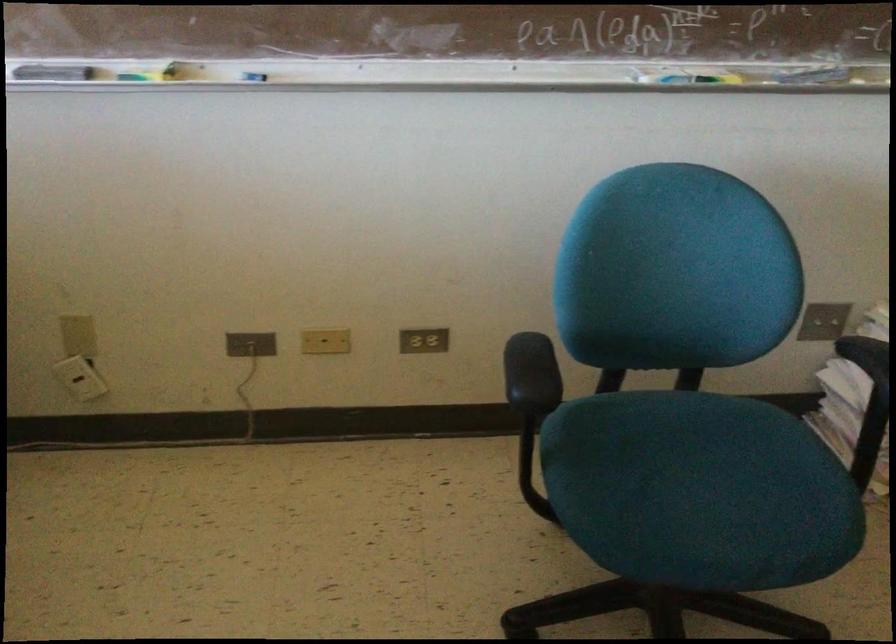
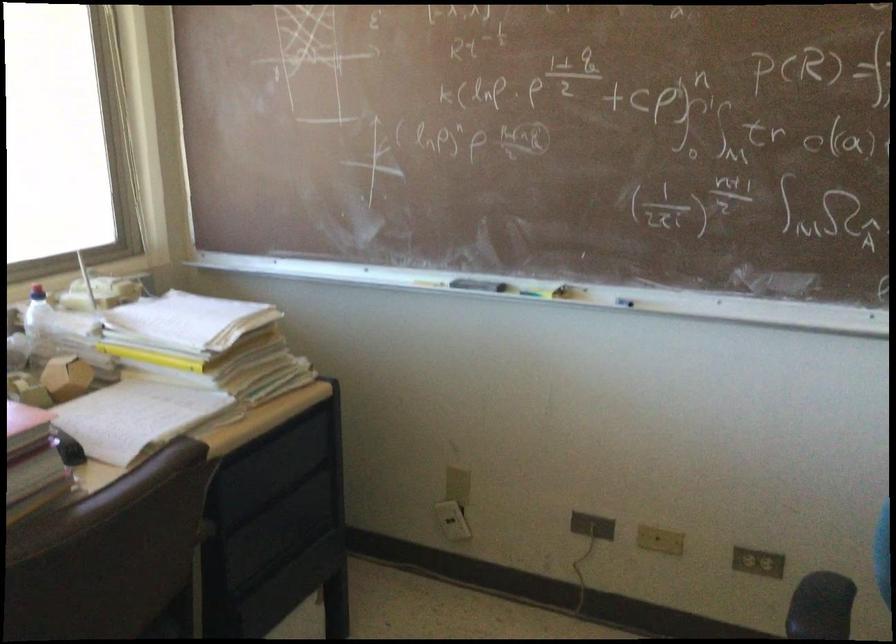
Find the pixel in the second image that matches (79,377) in the first image.

(452, 520)